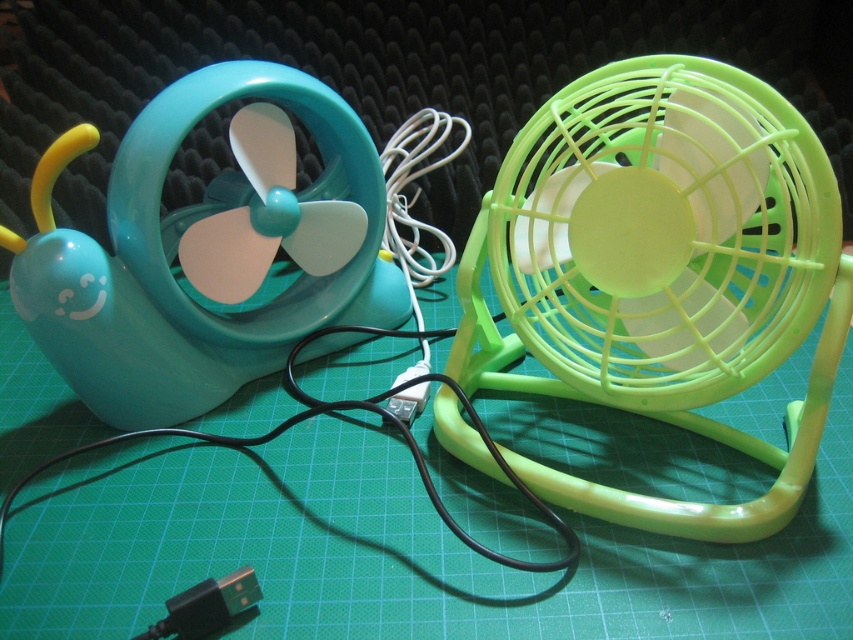
Question: Can you confirm if lime green plastic fan at right is positioned below black plastic usb plug at center?

Choices:
 (A) no
 (B) yes

Answer: (A)

Question: Which point is closer to the camera?

Choices:
 (A) (427, 368)
 (B) (799, 177)
 (C) (85, 316)

Answer: (B)

Question: Does lime green plastic fan at right have a smaller size compared to black plastic usb plug at center?

Choices:
 (A) yes
 (B) no

Answer: (B)

Question: Which object is the closest to the matte plastic snail-shaped fan at left?

Choices:
 (A) lime green plastic fan at right
 (B) black plastic usb plug at center
 (C) black plastic usb plug at lower left

Answer: (B)

Question: Which point is farther to the camera?

Choices:
 (A) (228, 392)
 (B) (566, 339)
 (C) (199, 602)

Answer: (A)

Question: Does lime green plastic fan at right appear under black plastic usb plug at lower left?

Choices:
 (A) no
 (B) yes

Answer: (A)